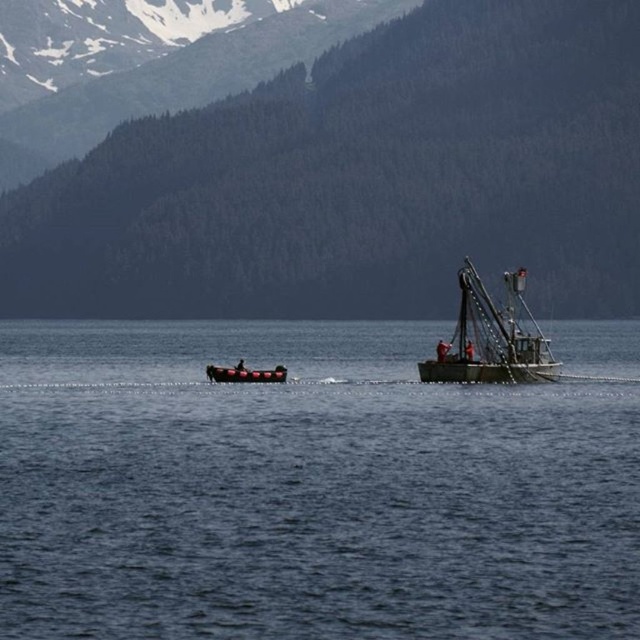
Question: Which point appears closest to the camera in this image?

Choices:
 (A) (540, 506)
 (B) (406, 205)

Answer: (A)

Question: Is blue water at center to the right of green forested mountain at upper center from the viewer's perspective?

Choices:
 (A) no
 (B) yes

Answer: (A)

Question: Which of these objects is positioned farthest from the green forested mountain at upper center?

Choices:
 (A) greenish metallic fishing boat at center
 (B) rubberized red inflatable boat at center
 (C) blue water at center

Answer: (B)

Question: Can you confirm if blue water at center is positioned to the right of green forested mountain at upper center?

Choices:
 (A) no
 (B) yes

Answer: (A)

Question: Considering the real-world distances, which object is farthest from the greenish metallic fishing boat at center?

Choices:
 (A) green forested mountain at upper center
 (B) rubberized red inflatable boat at center
 (C) blue water at center

Answer: (A)

Question: Is blue water at center in front of greenish metallic fishing boat at center?

Choices:
 (A) yes
 (B) no

Answer: (A)